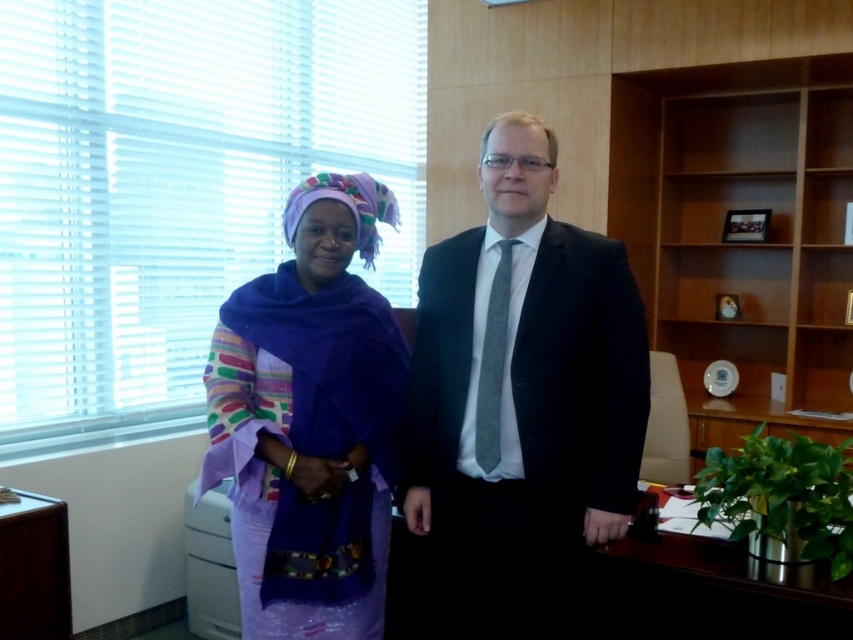
You are an interior designer assessing the office layout. The purple fabric at left is part of a sofa. Can you determine if the light brown wood bookshelf at right is positioned higher than the sofa?

The light brown wood bookshelf at right is located above the purple fabric at left, so yes, the bookshelf is positioned higher than the sofa.

You are a photographer setting up a shot in this office scene. You need to place a small reflector at point (521, 397). Which object will the reflector be placed on?

The reflector will be placed on the matte black suit at center, as the point (521, 397) is on that object.

You are an interior designer assessing the office layout. The matte black suit at center and the purple fabric at left are part of the decor. If you need to place a 1.2 meter wide desk between them, would there be enough space?

The matte black suit at center might be wider than purple fabric at left, so the space between them may be sufficient to accommodate a 1.2 meter desk. However, since the exact width difference isn not specified, it is recommended to measure the actual distance before placing the desk.